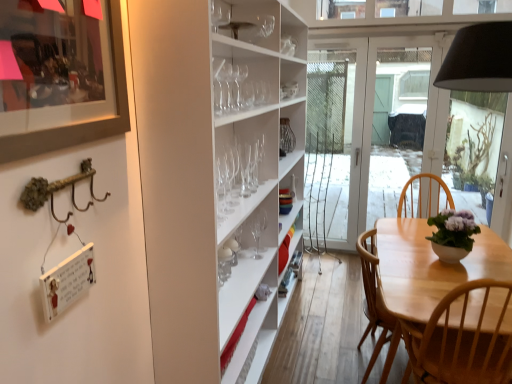
How much space does clear glass wine glass at center, the fifth wine glass positioned from the front, occupy vertically?

It is 9.77 inches.

Identify the location of purple matte flowerpot at center. This screenshot has width=512, height=384. [453, 234].

Locate an element on the screen. The image size is (512, 384). white glass door at center is located at coordinates (372, 126).

What do you see at coordinates (80, 124) in the screenshot? I see `matte black picture frame at upper left` at bounding box center [80, 124].

Locate an element on the screen. The image size is (512, 384). clear glass wine glass at center, the fifth wine glass positioned from the front is located at coordinates (258, 160).

Considering the sizes of objects clear glass wine glass at center, the fifth wine glass positioned from the front, and white glass door at center in the image provided, who is wider, clear glass wine glass at center, the fifth wine glass positioned from the front, or white glass door at center?

With larger width is white glass door at center.

Can you tell me how much clear glass wine glass at center, the second wine glass viewed from the back, and white glass door at center differ in facing direction?

clear glass wine glass at center, the second wine glass viewed from the back, and white glass door at center are facing 89.9 degrees away from each other.

Considering the relative sizes of clear glass wine glass at center, the second wine glass viewed from the back, and white glass door at center in the image provided, is clear glass wine glass at center, the second wine glass viewed from the back, shorter than white glass door at center?

Correct, clear glass wine glass at center, the second wine glass viewed from the back, is not as tall as white glass door at center.

From the image's perspective, which is below, clear glass wine glass at center, the fifth wine glass positioned from the front, or white glass door at center?

clear glass wine glass at center, the fifth wine glass positioned from the front, from the image's perspective.

Which of these two, clear glass wine glass at center, placed as the third wine glass when sorted from back to front, or clear glass wine glass at center, which appears as the second wine glass when viewed from the front, is thinner?

Thinner between the two is clear glass wine glass at center, which appears as the second wine glass when viewed from the front.

Considering the positions of point (254, 233) and point (242, 156), is point (254, 233) closer or farther from the camera than point (242, 156)?

Point (254, 233) is farther from the camera than point (242, 156).

How many degrees apart are the facing directions of clear glass wine glass at center, placed as the third wine glass when sorted from back to front, and clear glass wine glass at center, the 5th wine glass positioned from the back?

0.848 degrees.

Can you confirm if clear glass wine glass at center, placed as the third wine glass when sorted from back to front, is shorter than clear glass wine glass at center, which appears as the second wine glass when viewed from the front?

Correct, clear glass wine glass at center, placed as the third wine glass when sorted from back to front, is not as tall as clear glass wine glass at center, which appears as the second wine glass when viewed from the front.

Is matte black picture frame at upper left placed right next to clear glass wine glass at center, the 1th wine glass positioned from the back?

No, matte black picture frame at upper left is not with clear glass wine glass at center, the 1th wine glass positioned from the back.

From a real-world perspective, is matte black picture frame at upper left located higher than clear glass wine glass at center, which appears as the sixth wine glass when viewed from the front?

Yes, from a real-world perspective, matte black picture frame at upper left is over clear glass wine glass at center, which appears as the sixth wine glass when viewed from the front

Which is in front, point (114, 23) or point (258, 257)?

Positioned in front is point (114, 23).

Considering the sizes of objects matte black picture frame at upper left and clear glass wine glass at center, which appears as the sixth wine glass when viewed from the front, in the image provided, who is smaller, matte black picture frame at upper left or clear glass wine glass at center, which appears as the sixth wine glass when viewed from the front,?

With smaller size is clear glass wine glass at center, which appears as the sixth wine glass when viewed from the front.

Is clear glass wine glass at center, which appears as the sixth wine glass when viewed from the front, outside of transparent glass wine glass at upper center, the sixth wine glass viewed from the back?

Yes, clear glass wine glass at center, which appears as the sixth wine glass when viewed from the front, is located beyond the bounds of transparent glass wine glass at upper center, the sixth wine glass viewed from the back.

In the scene shown: In terms of size, does clear glass wine glass at center, which appears as the sixth wine glass when viewed from the front, appear bigger or smaller than transparent glass wine glass at upper center, the sixth wine glass viewed from the back?

Considering their sizes, clear glass wine glass at center, which appears as the sixth wine glass when viewed from the front, takes up more space than transparent glass wine glass at upper center, the sixth wine glass viewed from the back.

Can you tell me how much clear glass wine glass at center, the 1th wine glass positioned from the back, and transparent glass wine glass at upper center, the sixth wine glass viewed from the back, differ in facing direction?

0.042 degrees separate the facing orientations of clear glass wine glass at center, the 1th wine glass positioned from the back, and transparent glass wine glass at upper center, the sixth wine glass viewed from the back.

Measure the distance from clear glass wine glass at center, which appears as the sixth wine glass when viewed from the front, to transparent glass wine glass at upper center, which is the first wine glass from front to back.

28.62 inches.

Which of these two, clear glass wine glass at center, which ranks as the fourth wine glass in front-to-back order, or white glass door at center, stands taller?

With more height is white glass door at center.

From the image's perspective, which one is positioned higher, clear glass wine glass at center, which ranks as the fourth wine glass in front-to-back order, or white glass door at center?

From the image's view, white glass door at center is above.

Looking at the image, does clear glass wine glass at center, the fifth wine glass positioned from the front, seem bigger or smaller compared to light wood chair at lower right?

In the image, clear glass wine glass at center, the fifth wine glass positioned from the front, appears to be smaller than light wood chair at lower right.

Which is in front, clear glass wine glass at center, the second wine glass viewed from the back, or light wood chair at lower right?

light wood chair at lower right is closer to the camera.

Is clear glass wine glass at center, the fifth wine glass positioned from the front, shorter than light wood chair at lower right?

Yes.

Does clear glass wine glass at center, the second wine glass viewed from the back, contain light wood chair at lower right?

Definitely not — light wood chair at lower right is not inside clear glass wine glass at center, the second wine glass viewed from the back.

Does point (387, 260) come behind point (239, 158)?

No, it is not.

From a real-world perspective, between light wood chair at lower right and clear glass wine glass at center, which appears as the second wine glass when viewed from the front, who is vertically lower?

In real-world perspective, light wood chair at lower right is lower.

Based on the photo, considering the positions of objects light wood chair at lower right and clear glass wine glass at center, which appears as the second wine glass when viewed from the front, in the image provided, who is more to the left, light wood chair at lower right or clear glass wine glass at center, which appears as the second wine glass when viewed from the front,?

From the viewer's perspective, clear glass wine glass at center, which appears as the second wine glass when viewed from the front, appears more on the left side.

The image size is (512, 384). Identify the location of chair in front of the clear glass wine glass at center, which appears as the second wine glass when viewed from the front. point(429,266).

I want to click on wine glass that is the 3rd object above the white glass door at center (from a real-world perspective), so click(258, 160).

Which wine glass is the 2nd one when counting from the back of the clear glass wine glass at center, the 5th wine glass positioned from the back? Please provide its 2D coordinates.

[(257, 234)]

Which object lies further to the anchor point clear glass vase at center, transparent glass wine glass at upper center, the sixth wine glass viewed from the back, or clear glass wine glass at center, arranged as the fourth wine glass when viewed from the back?

transparent glass wine glass at upper center, the sixth wine glass viewed from the back.

When comparing their distances from purple matte flowerpot at center, does matte black picture frame at upper left or transparent glass wine glass at upper center, the sixth wine glass viewed from the back, seem further?

The object further to purple matte flowerpot at center is matte black picture frame at upper left.

Which object lies nearer to the anchor point clear glass wine glass at center, the second wine glass viewed from the back, clear glass wine glass at center, arranged as the fourth wine glass when viewed from the back, or clear glass vase at center?

Based on the image, clear glass wine glass at center, arranged as the fourth wine glass when viewed from the back, appears to be nearer to clear glass wine glass at center, the second wine glass viewed from the back.

From the image, which object appears to be nearer to transparent glass wine glass at upper center, which is the first wine glass from front to back, clear glass vase at center or purple matte flowerpot at center?

clear glass vase at center is closer to transparent glass wine glass at upper center, which is the first wine glass from front to back.

Considering their positions, is clear glass wine glass at center, the fifth wine glass positioned from the front, positioned closer to clear glass wine glass at center, the 1th wine glass positioned from the back, than transparent glass wine glass at upper center, the sixth wine glass viewed from the back?

Based on the image, clear glass wine glass at center, the fifth wine glass positioned from the front, appears to be nearer to clear glass wine glass at center, the 1th wine glass positioned from the back.

Which object lies further to the anchor point clear glass vase at center, clear glass wine glass at center, the second wine glass viewed from the back, or transparent glass wine glass at upper center, which is the first wine glass from front to back?

Based on the image, transparent glass wine glass at upper center, which is the first wine glass from front to back, appears to be further to clear glass vase at center.

Looking at the image, which one is located further to purple matte flowerpot at center, clear glass wine glass at center, placed as the third wine glass when sorted from back to front, or clear glass wine glass at center, which appears as the second wine glass when viewed from the front?

Among the two, clear glass wine glass at center, which appears as the second wine glass when viewed from the front, is located further to purple matte flowerpot at center.

Looking at the image, which one is located further to clear glass wine glass at center, the second wine glass viewed from the back, clear glass wine glass at center, which ranks as the fourth wine glass in front-to-back order, or transparent glass wine glass at upper center, the sixth wine glass viewed from the back?

The object further to clear glass wine glass at center, the second wine glass viewed from the back, is transparent glass wine glass at upper center, the sixth wine glass viewed from the back.

Identify the location of houseplant between transparent glass wine glass at upper center, which is the first wine glass from front to back, and clear glass vase at center in the front-back direction. (453, 234).

I want to click on glass vase located between clear glass wine glass at center, which appears as the sixth wine glass when viewed from the front, and white glass door at center in the left-right direction, so click(286, 136).

At what (x,y) coordinates should I click in order to perform the action: click on glass vase between clear glass wine glass at center, arranged as the fourth wine glass when viewed from the back, and white glass door at center. Please return your answer as a coordinate pair (x, y). Image resolution: width=512 pixels, height=384 pixels. Looking at the image, I should click on (286, 136).

Locate an element on the screen. Image resolution: width=512 pixels, height=384 pixels. chair located between matte black picture frame at upper left and white glass door at center in the depth direction is located at coordinates (429, 266).